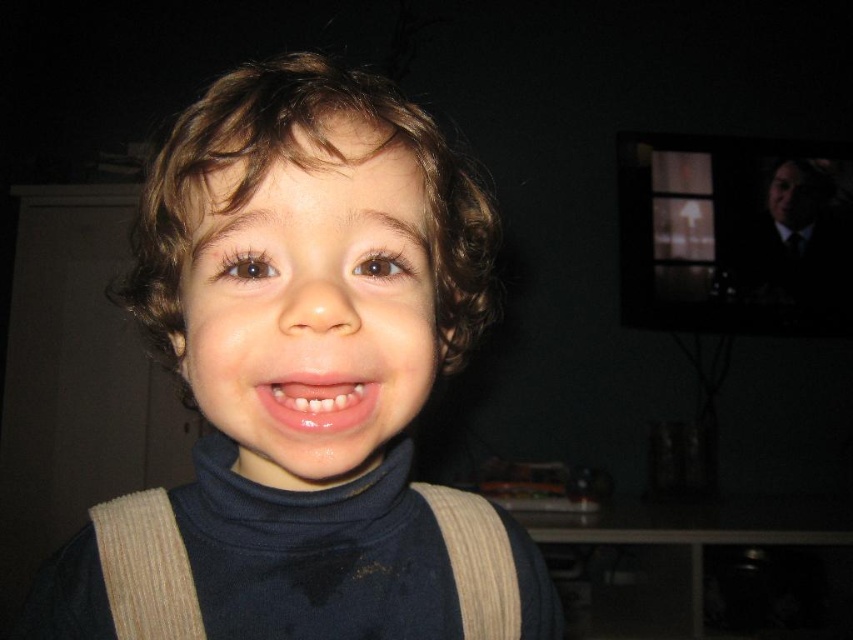
You are a photographer adjusting the lighting in the room. You notice the point at coordinates (303, 371) on the image. What object is located at this point?

The point at coordinates (303, 371) corresponds to the dark blue turtleneck sweater at center.

You are a photographer adjusting lighting for a portrait. You need to ensure both the smooth skin face at center and glossy pink lips at center are well lit. Given their sizes, which area requires more focused lighting to capture details?

The glossy pink lips at center are smaller than the smooth skin face at center, so they require more focused lighting to capture details properly.